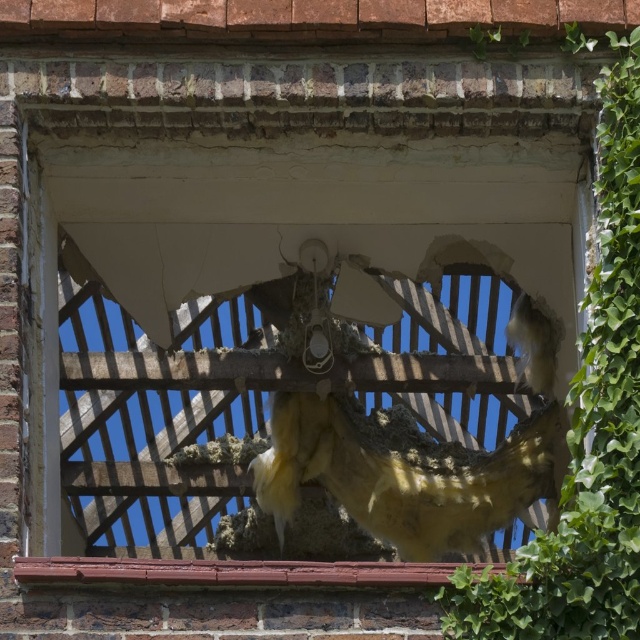
Question: Does green leafy ivy at right appear over smooth brick window sill at lower center?

Choices:
 (A) yes
 (B) no

Answer: (A)

Question: Which object appears closest to the camera in this image?

Choices:
 (A) green leafy ivy at right
 (B) fuzzy yellow bird at center
 (C) smooth brick window sill at lower center

Answer: (C)

Question: Which object is the farthest from the smooth brick window sill at lower center?

Choices:
 (A) fuzzy yellow bird at center
 (B) green leafy ivy at right

Answer: (A)

Question: Which point is farther from the camera taking this photo?

Choices:
 (A) (573, 449)
 (B) (355, 467)
 (C) (161, 572)

Answer: (B)

Question: Can you confirm if fuzzy yellow bird at center is positioned below smooth brick window sill at lower center?

Choices:
 (A) no
 (B) yes

Answer: (B)

Question: Is fuzzy yellow bird at center thinner than smooth brick window sill at lower center?

Choices:
 (A) no
 (B) yes

Answer: (B)